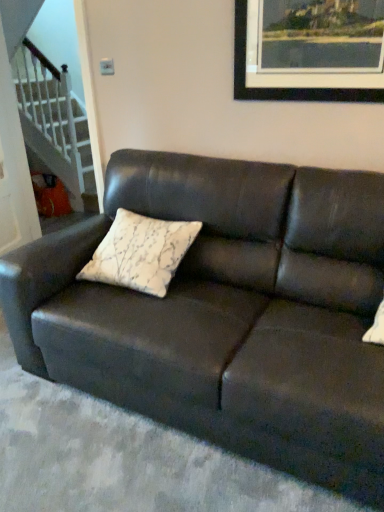
Question: Considering the positions of matte black couch at center and white textured pillow at center in the image, is matte black couch at center bigger or smaller than white textured pillow at center?

Choices:
 (A) small
 (B) big

Answer: (B)

Question: Is matte black couch at center taller or shorter than white textured pillow at center?

Choices:
 (A) tall
 (B) short

Answer: (A)

Question: Estimate the real-world distances between objects in this image. Which object is farther from the white textured pillow at center?

Choices:
 (A) wooden picture frame at upper center
 (B) white glossy staircase at lower left
 (C) matte black couch at center

Answer: (B)

Question: Which object is positioned closest to the white glossy staircase at lower left?

Choices:
 (A) matte black couch at center
 (B) white textured pillow at center
 (C) wooden picture frame at upper center

Answer: (B)